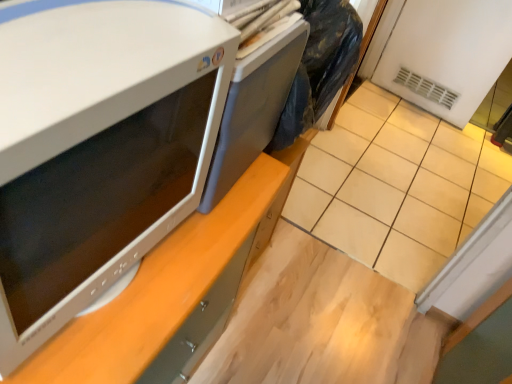
Question: In the image, is white glossy microwave at left on the left side or the right side of beige tile at lower right?

Choices:
 (A) left
 (B) right

Answer: (A)

Question: From their relative heights in the image, would you say white glossy microwave at left is taller or shorter than beige tile at lower right?

Choices:
 (A) tall
 (B) short

Answer: (B)

Question: Based on their relative distances, which object is farther from the beige tile at lower right?

Choices:
 (A) white glossy microwave at left
 (B) satin gray desktop at center

Answer: (A)

Question: Estimate the real-world distances between objects in this image. Which object is farther from the beige tile at lower right?

Choices:
 (A) satin gray desktop at center
 (B) white glossy microwave at left

Answer: (B)